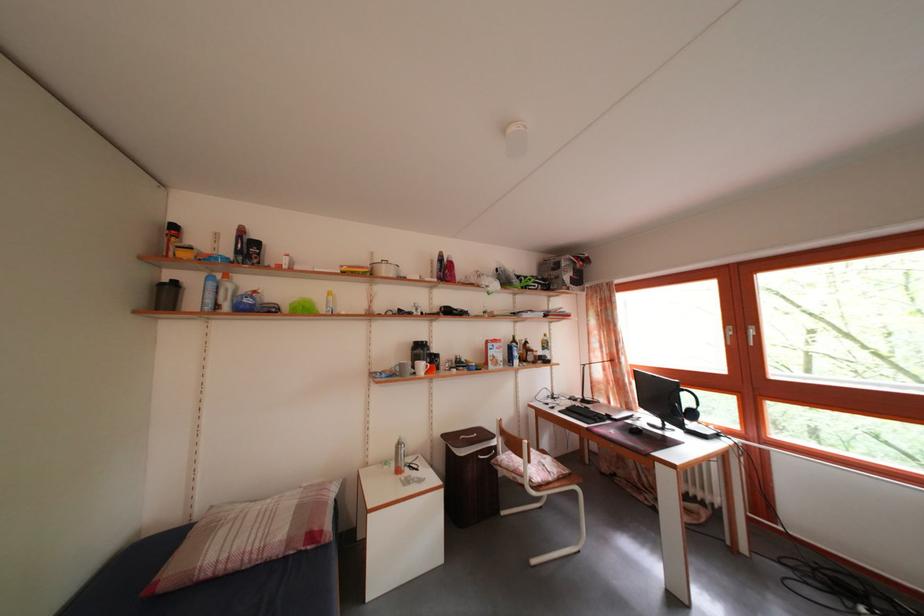
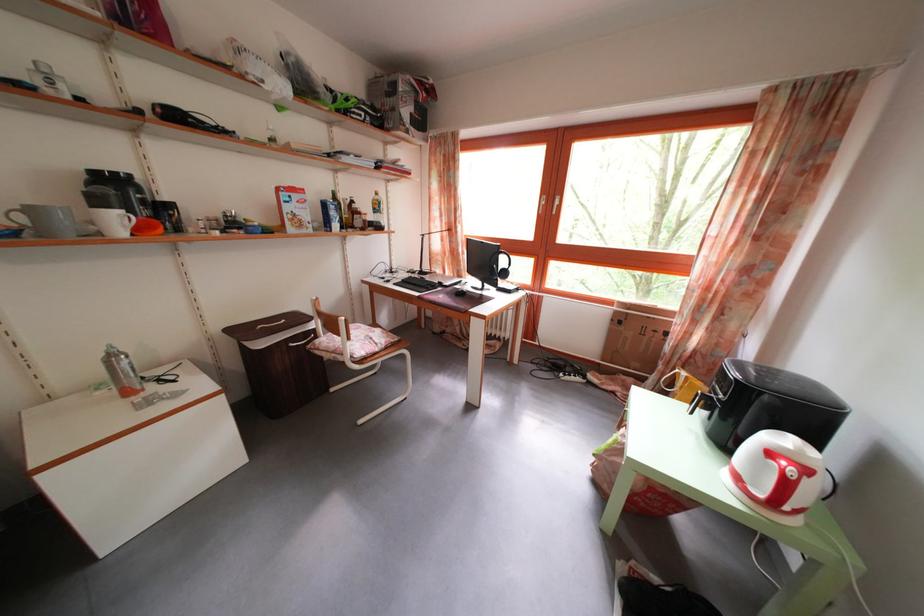
How did the camera likely rotate?

The camera rotated toward right-down.